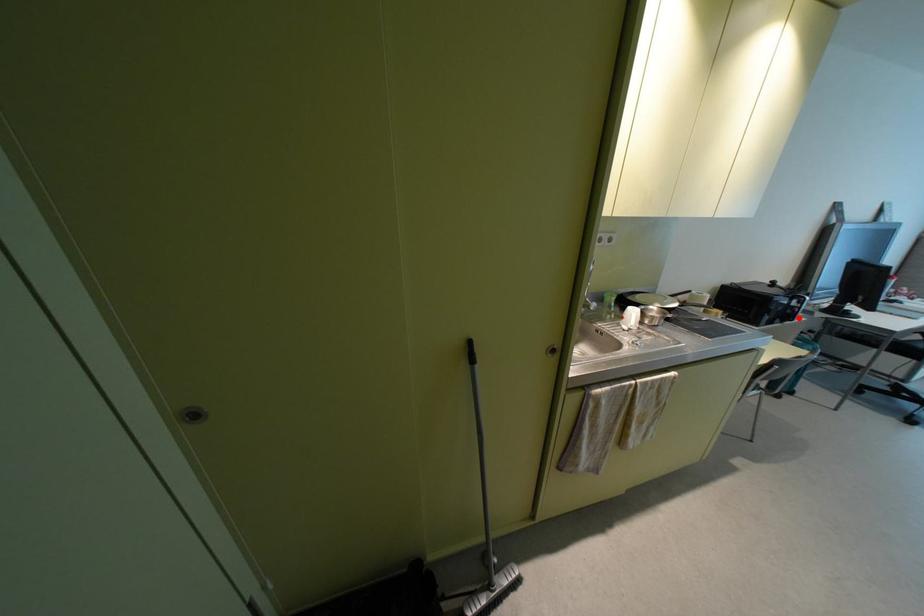
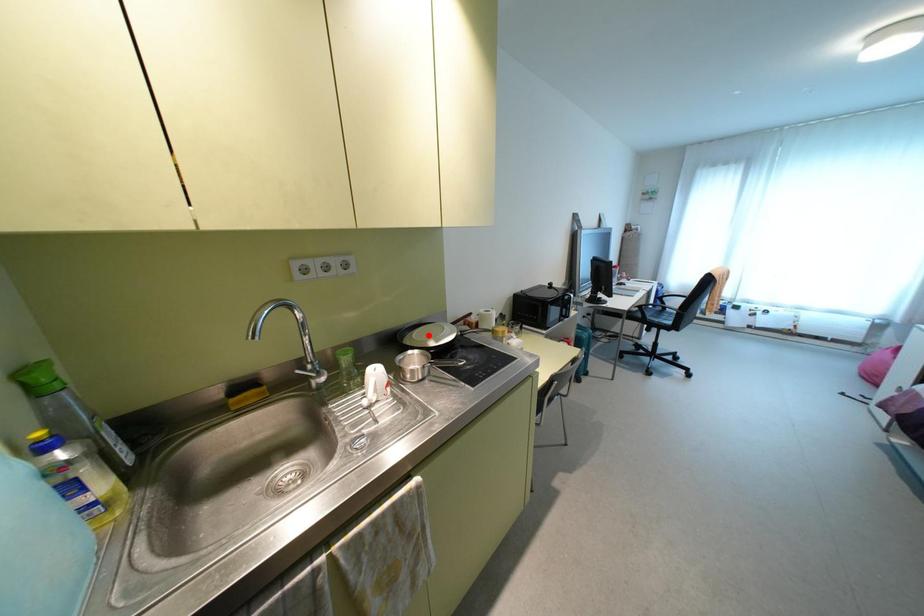
I am providing you with two images of the same scene from different viewpoints. A red point is marked on the first image and another point is marked on the second image. Does the point marked in image1 correspond to the same location as the one in image2?

No